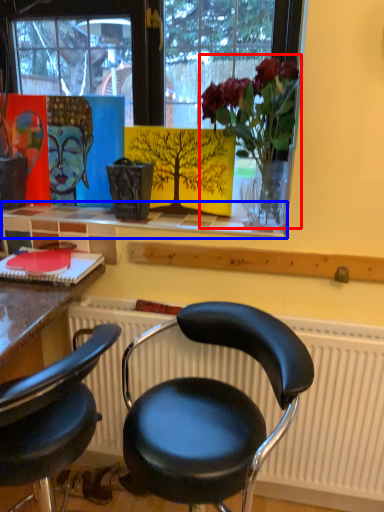
Question: Which object appears closest to the camera in this image, floral arrangement (highlighted by a red box) or window sill (highlighted by a blue box)?

Choices:
 (A) floral arrangement
 (B) window sill

Answer: (A)